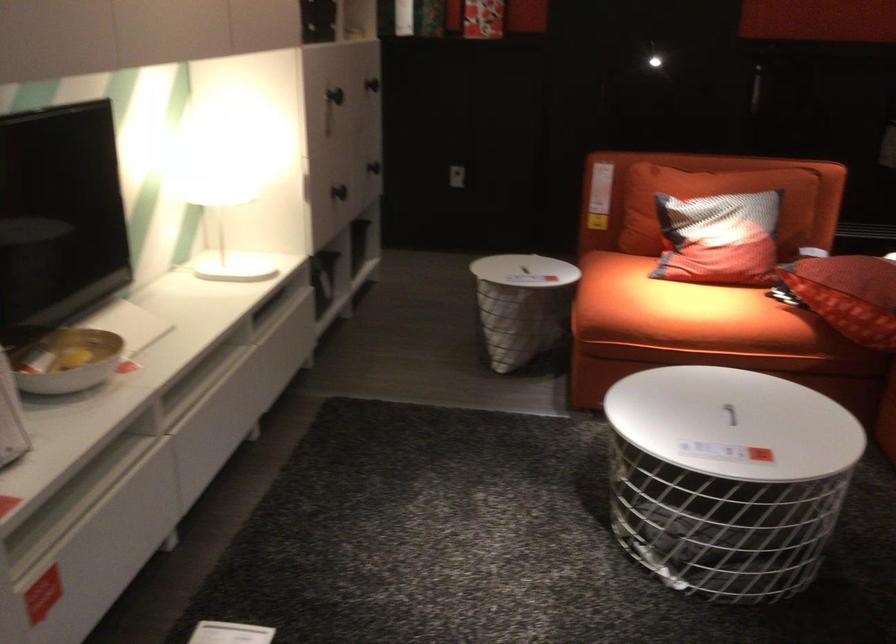
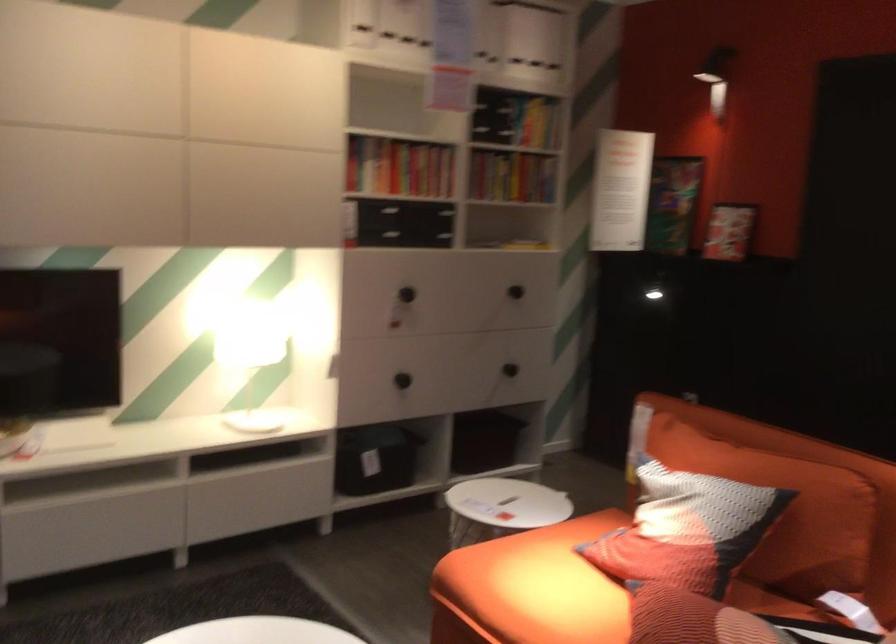
Find the pixel in the second image that matches pixel 340 198 in the first image.

(401, 380)